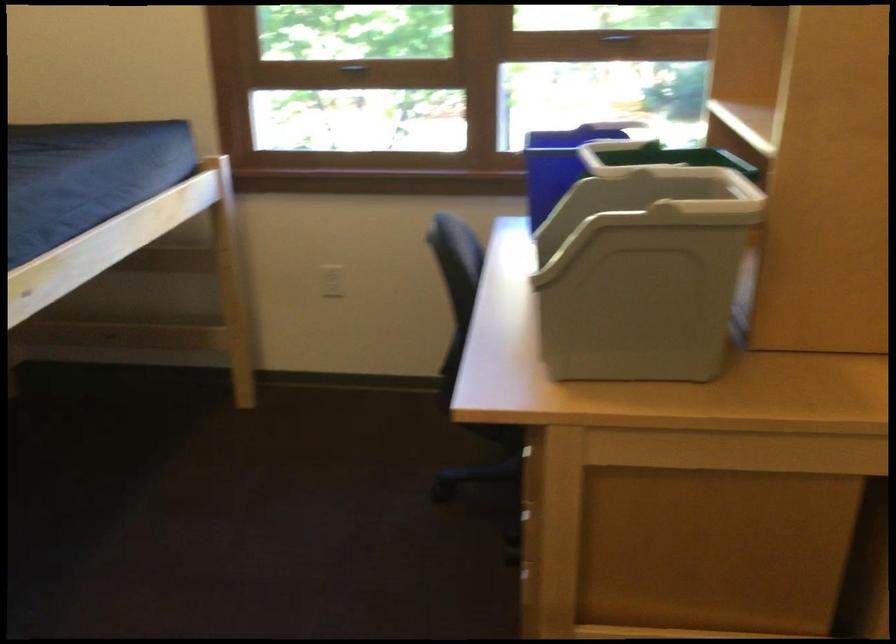
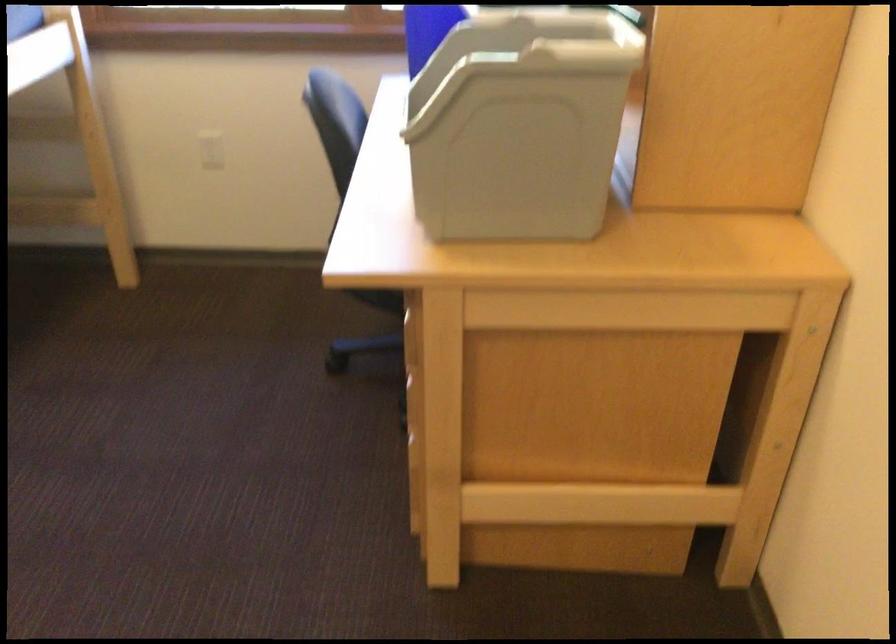
In the second image, find the point that corresponds to (x=682, y=180) in the first image.

(565, 24)